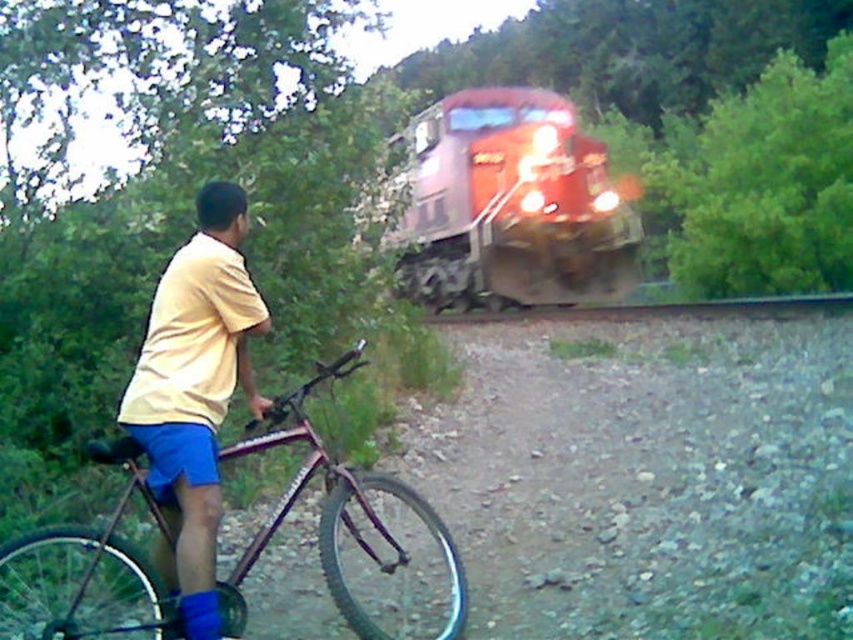
Question: Does yellow matte shirt at left lie in front of metallic purple mountain bike at left?

Choices:
 (A) no
 (B) yes

Answer: (A)

Question: Based on their relative distances, which object is farther from the yellow matte shirt at left?

Choices:
 (A) metallic purple mountain bike at left
 (B) red glossy train at center

Answer: (B)

Question: Which of the following is the farthest from the observer?

Choices:
 (A) metallic purple mountain bike at left
 (B) yellow matte shirt at left

Answer: (B)

Question: Among these objects, which one is nearest to the camera?

Choices:
 (A) yellow matte shirt at left
 (B) metallic purple mountain bike at left
 (C) red glossy train at center

Answer: (B)

Question: Can you confirm if red glossy train at center is positioned to the left of yellow matte shirt at left?

Choices:
 (A) no
 (B) yes

Answer: (A)

Question: Considering the relative positions of yellow matte shirt at left and metallic purple mountain bike at left in the image provided, where is yellow matte shirt at left located with respect to metallic purple mountain bike at left?

Choices:
 (A) below
 (B) above

Answer: (B)